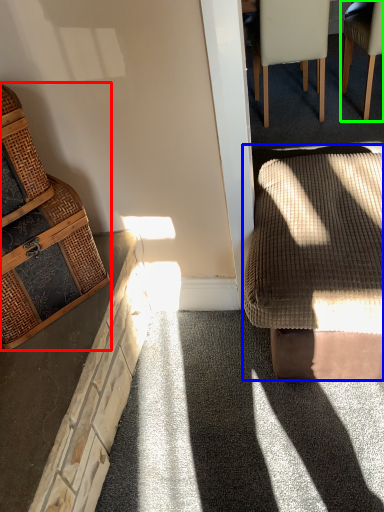
Question: Which object is positioned closest to chair (highlighted by a red box)? Select from rocking chair (highlighted by a blue box) and chair (highlighted by a green box).

Choices:
 (A) rocking chair
 (B) chair

Answer: (A)